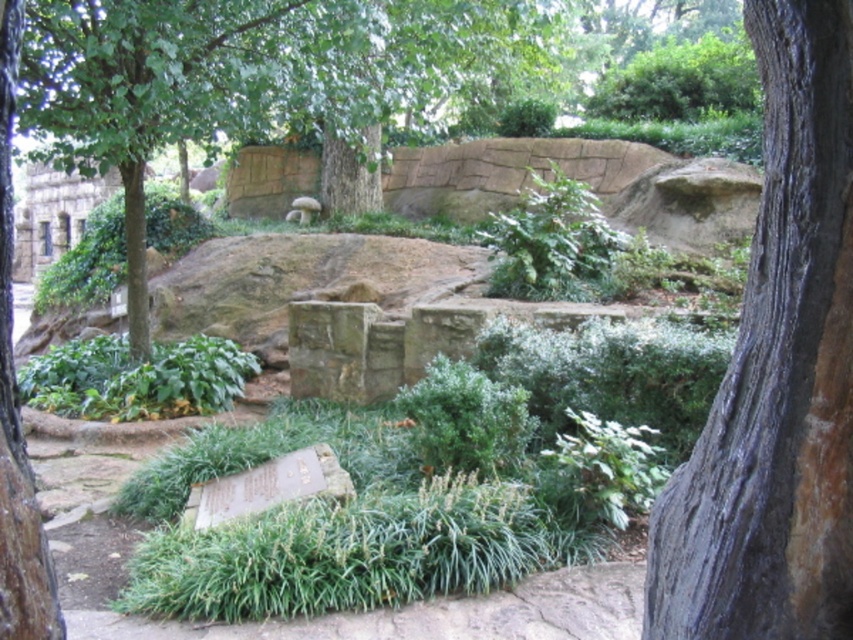
Question: Does green leafy tree at upper center appear on the right side of white fuzzy animal at center?

Choices:
 (A) no
 (B) yes

Answer: (B)

Question: Which of the following is the farthest from the observer?

Choices:
 (A) green leafy tree at upper center
 (B) white fuzzy animal at center
 (C) gray textured bark at center

Answer: (B)

Question: Is green leafy tree at upper center below white fuzzy animal at center?

Choices:
 (A) no
 (B) yes

Answer: (A)

Question: Which object appears farthest from the camera in this image?

Choices:
 (A) white fuzzy animal at center
 (B) gray textured bark at center
 (C) green leafy tree at upper center

Answer: (A)

Question: Which point is farther to the camera?

Choices:
 (A) (32, 515)
 (B) (828, 634)

Answer: (A)

Question: Does green leafy tree at upper center lie in front of brown rough bark at left?

Choices:
 (A) yes
 (B) no

Answer: (B)